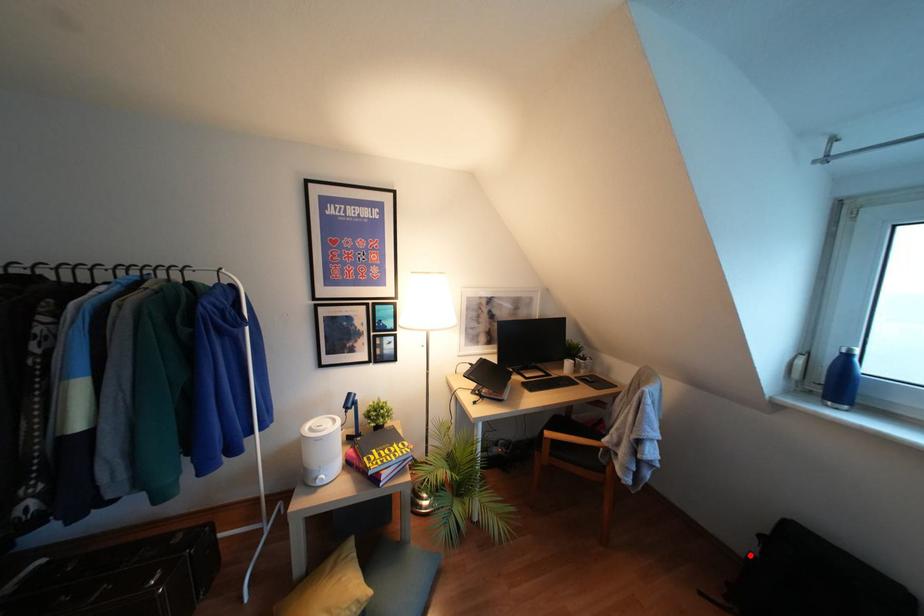
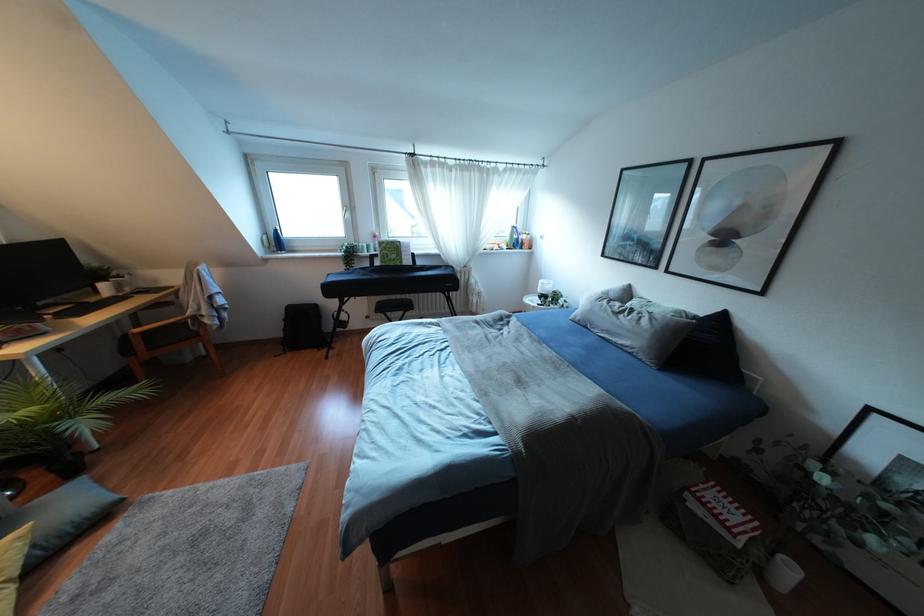
Question: I am providing you with two images of the same scene from different viewpoints. Image1 has a red point marked. In image2, the corresponding 3D location appears at what relative position? Reply with the corresponding letter.

Choices:
 (A) Closer
 (B) Farther

Answer: (A)